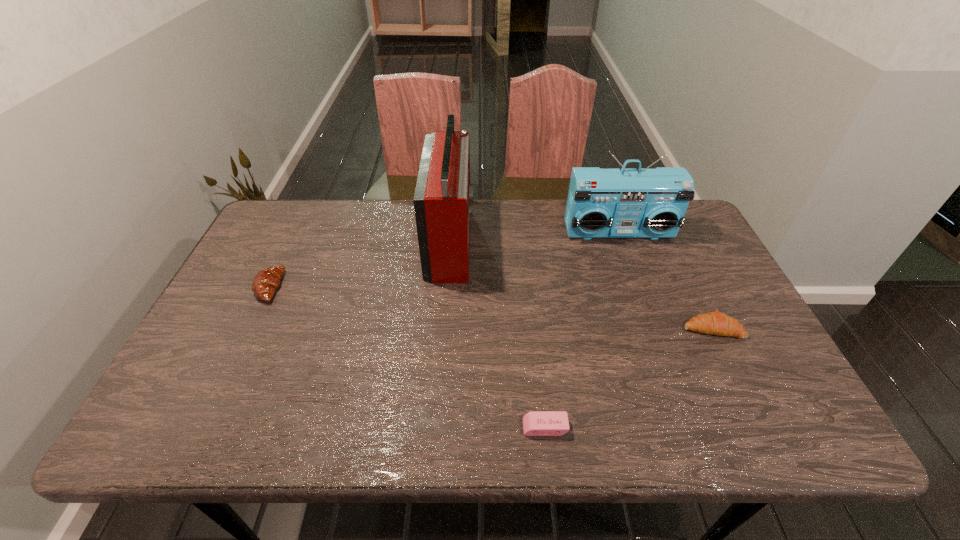
Where is `free space between the second nearest object and the leftmost object`? free space between the second nearest object and the leftmost object is located at coordinates (491, 307).

The image size is (960, 540). Identify the location of free space between the taller radio receiver and the shorter radio receiver. (535, 237).

The width and height of the screenshot is (960, 540). I want to click on vacant point located between the eraser and the left crescent roll, so click(407, 357).

What are the coordinates of `vacant point located between the left radio receiver and the nearest object` in the screenshot? It's located at (498, 334).

This screenshot has height=540, width=960. Identify the location of vacant area that lies between the second tallest object and the tallest object. (535, 237).

Locate an element on the screen. This screenshot has height=540, width=960. the third closest object relative to the second tallest object is located at coordinates (535, 423).

This screenshot has width=960, height=540. Identify the location of the closest object to the farther crescent roll. (442, 201).

You are a GUI agent. You are given a task and a screenshot of the screen. Output one action in this format:
    pyautogui.click(x=<x>, y=<y>)
    Task: Click on the vacant space that satisfies the following two spatial constraints: 1. on the front-facing side of the right radio receiver; 2. on the front-facing side of the taller radio receiver
    
    Given the screenshot: What is the action you would take?
    pyautogui.click(x=622, y=241)

Image resolution: width=960 pixels, height=540 pixels. In order to click on free spot that satisfies the following two spatial constraints: 1. on the front-facing side of the left radio receiver; 2. on the right side of the right crescent roll in this screenshot , I will do `click(444, 328)`.

Locate an element on the screen. The height and width of the screenshot is (540, 960). vacant region that satisfies the following two spatial constraints: 1. on the front-facing side of the right crescent roll; 2. on the left side of the second object from left to right is located at coordinates (444, 328).